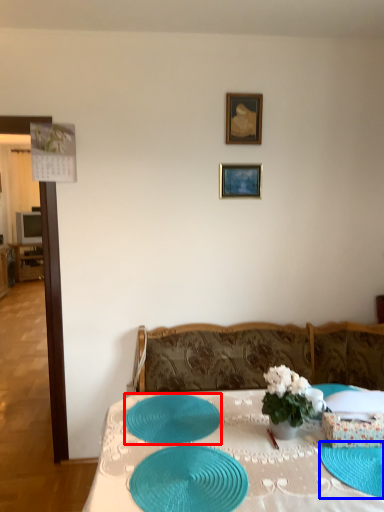
Question: Among these objects, which one is nearest to the camera, tableware (highlighted by a red box) or glass plate (highlighted by a blue box)?

Choices:
 (A) tableware
 (B) glass plate

Answer: (B)